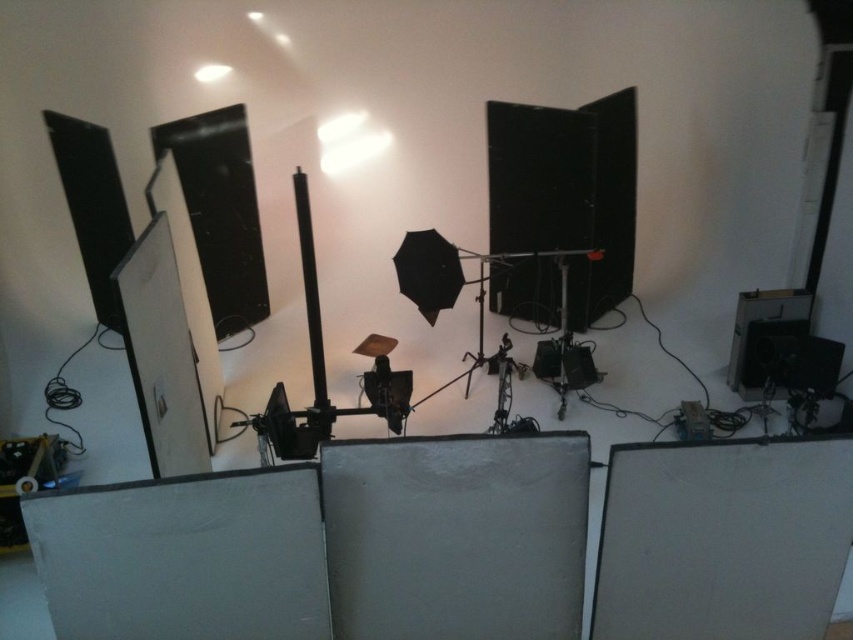
Find the location of a particular element. matte black speaker at upper left is located at coordinates (93, 205).

Can you confirm if matte black speaker at upper left is taller than black plastic speaker at lower right?

Yes, matte black speaker at upper left is taller than black plastic speaker at lower right.

Which is behind, point (96, 140) or point (762, 332)?

Point (96, 140)

This screenshot has width=853, height=640. I want to click on matte black speaker at upper left, so click(x=93, y=205).